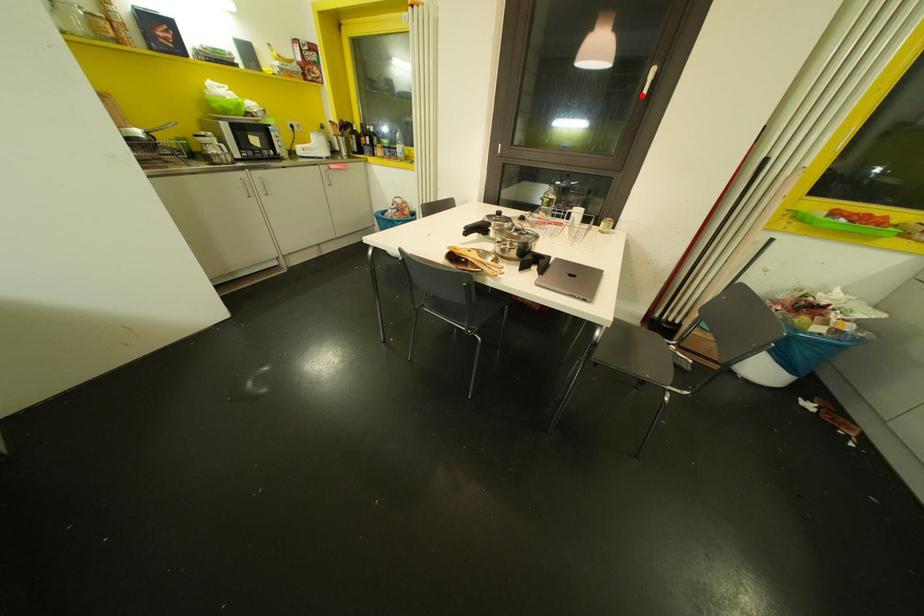
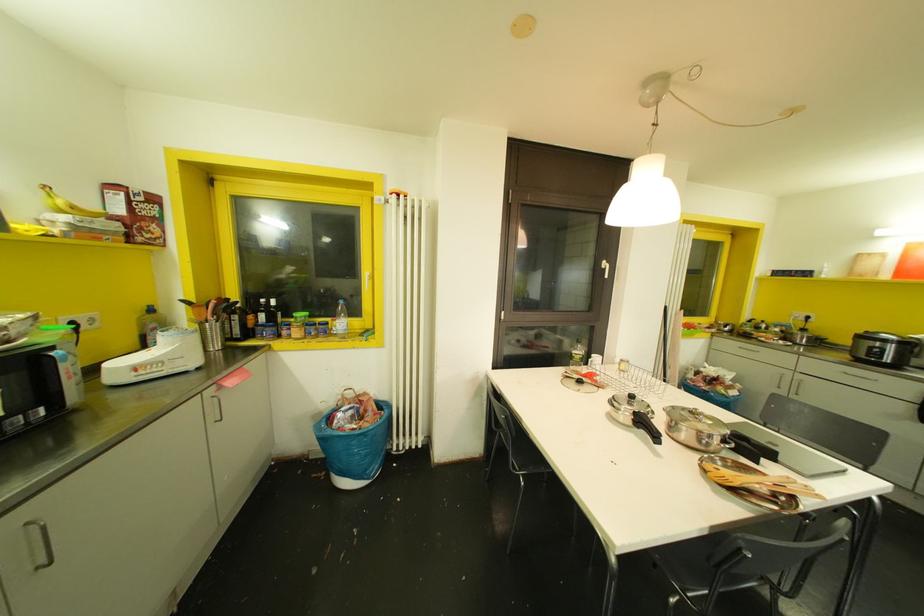
Question: I am providing you with two images of the same scene from different viewpoints. A red point is marked on the first image. At the location where the point appears in image 1, is it still visible in image 2?

Choices:
 (A) Yes
 (B) No

Answer: (A)